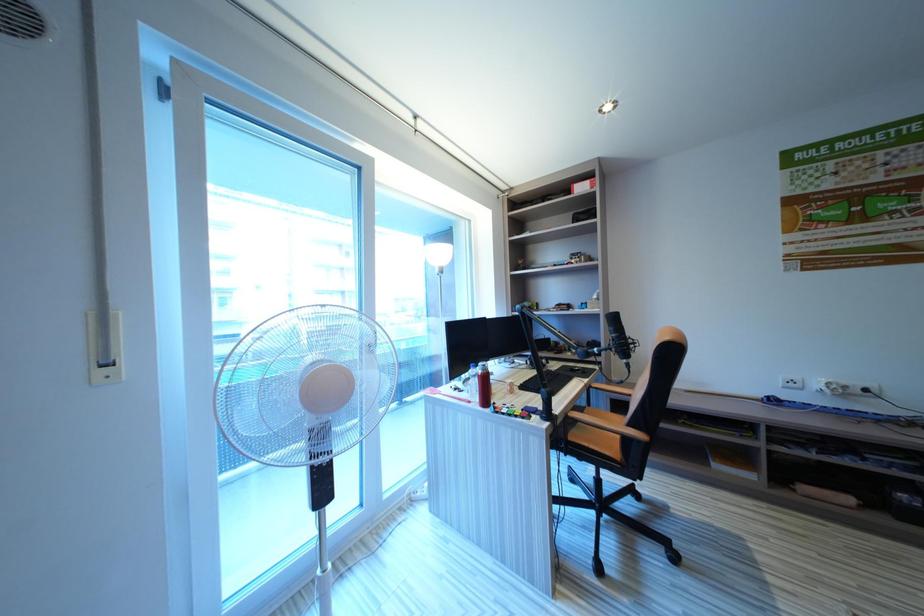
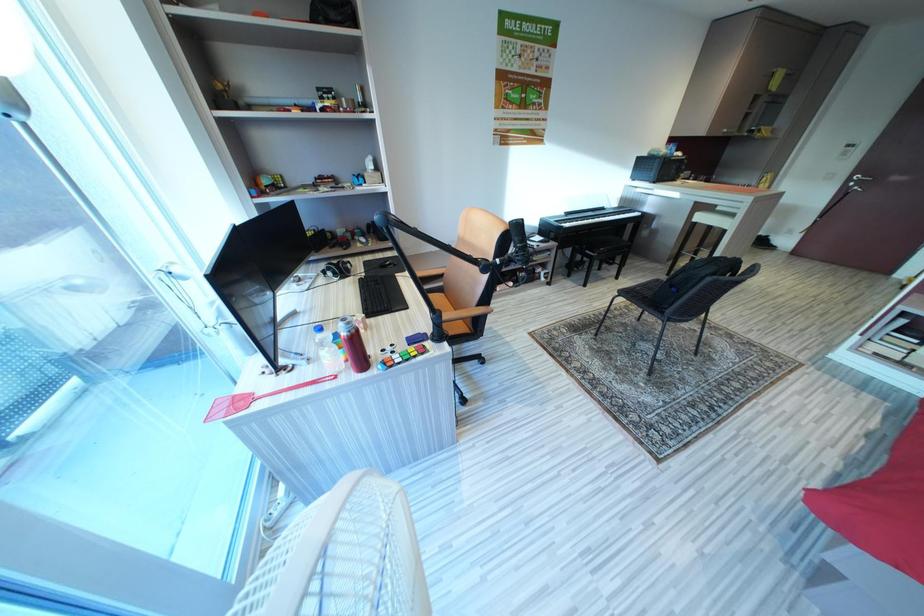
How did the camera likely rotate?

The rotation direction of the camera is right-down.